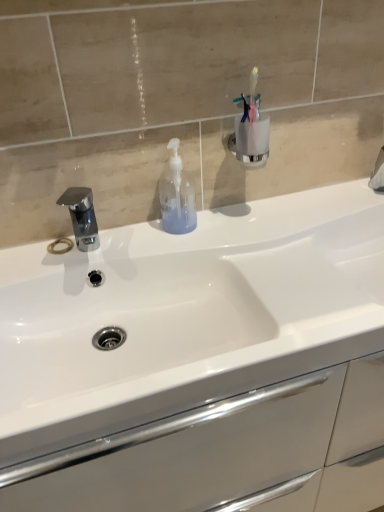
At what (x,y) coordinates should I click in order to perform the action: click on vacant area that lies to the right of translucent plastic soap dispenser at center. Please return your answer as a coordinate pair (x, y). Image resolution: width=384 pixels, height=512 pixels. Looking at the image, I should click on (245, 224).